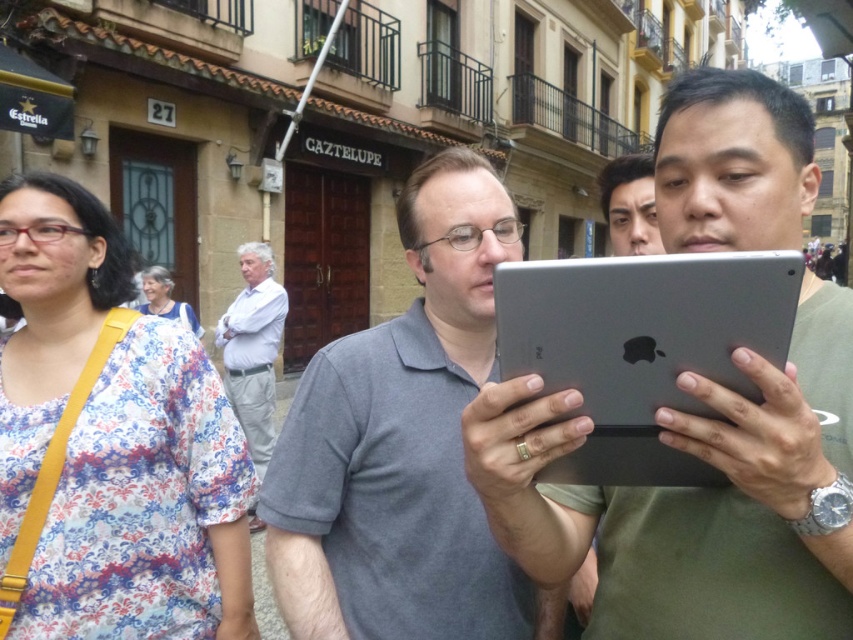
You are a photographer trying to capture a clear shot of the matte gray tablet at center and the matte black face at upper center. Which object will appear larger in your photo?

The matte gray tablet at center will appear larger in the photo because it is positioned in front of the matte black face at upper center, making it closer to the camera.

You are a photographer taking a picture of the matte gray tablet at center and the floral fabric blouse at left. Which object is closer to your camera lens?

The floral fabric blouse at left is closer to the camera lens because it is further to the viewer than the matte gray tablet at center.